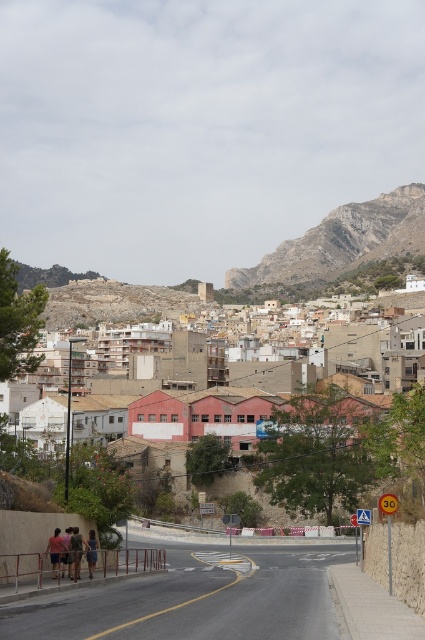
Between denim shorts at lower left and light brown leather jacket at lower left, which one is positioned higher?

light brown leather jacket at lower left

Can you confirm if denim shorts at lower left is smaller than light brown leather jacket at lower left?

No, denim shorts at lower left is not smaller than light brown leather jacket at lower left.

The image size is (425, 640). In order to click on denim shorts at lower left in this screenshot , I will do `click(91, 552)`.

Does beige stone buildings at center appear under light brown leather jacket at lower left?

Incorrect, beige stone buildings at center is not positioned below light brown leather jacket at lower left.

At what (x,y) coordinates should I click in order to perform the action: click on beige stone buildings at center. Please return your answer as a coordinate pair (x, y). The image size is (425, 640). Looking at the image, I should click on (354, 458).

Who is more distant from viewer, (384, 461) or (67, 536)?

Point (384, 461)

The height and width of the screenshot is (640, 425). In order to click on beige stone buildings at center in this screenshot , I will do `click(354, 458)`.

Does rugged stone mountain at upper right appear under dark brown leather jacket at lower left?

No.

Is rugged stone mountain at upper right above dark brown leather jacket at lower left?

Indeed, rugged stone mountain at upper right is positioned over dark brown leather jacket at lower left.

Who is more distant from viewer, (331, 214) or (79, 536)?

Positioned behind is point (331, 214).

You are a GUI agent. You are given a task and a screenshot of the screen. Output one action in this format:
    pyautogui.click(x=<x>, y=<y>)
    Task: Click on the rugged stone mountain at upper right
    
    Given the screenshot: What is the action you would take?
    pyautogui.click(x=342, y=241)